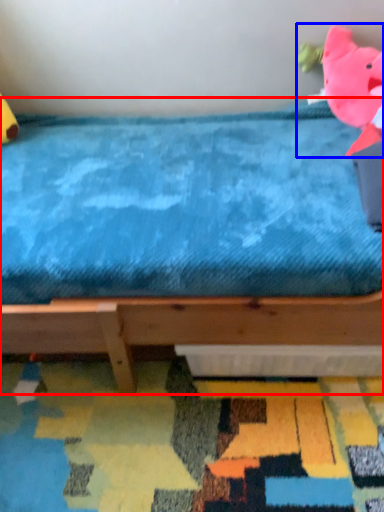
Question: Which object appears closest to the camera in this image, bed (highlighted by a red box) or toy (highlighted by a blue box)?

Choices:
 (A) bed
 (B) toy

Answer: (A)